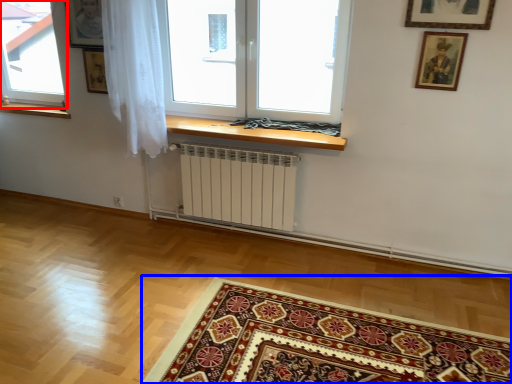
Question: Which point is closer to the camera, window (highlighted by a red box) or mat (highlighted by a blue box)?

Choices:
 (A) window
 (B) mat

Answer: (B)